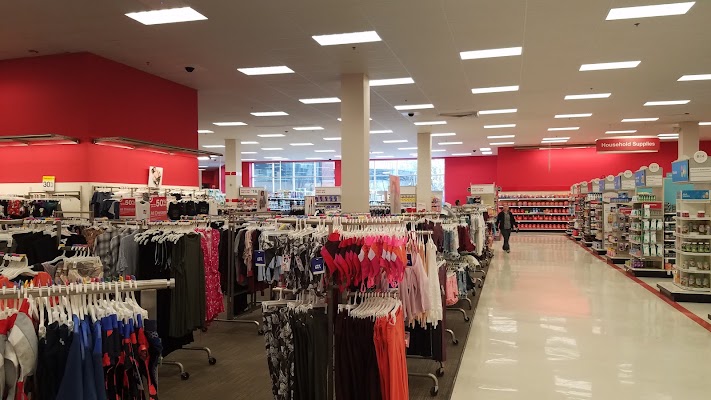
Locate an element on the screen. The width and height of the screenshot is (711, 400). white tile is located at coordinates tap(550, 275), tap(559, 324).